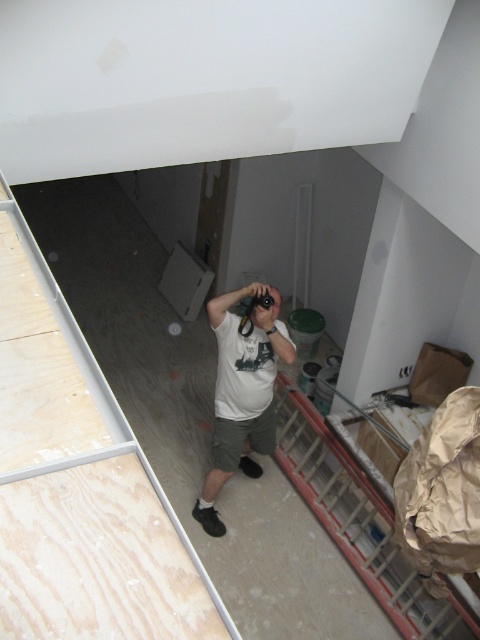
Does metallic red ladder at lower right appear over white matte t-shirt at center?

Incorrect, metallic red ladder at lower right is not positioned above white matte t-shirt at center.

Is metallic red ladder at lower right smaller than white matte t-shirt at center?

No.

In order to click on metallic red ladder at lower right in this screenshot , I will do 360,522.